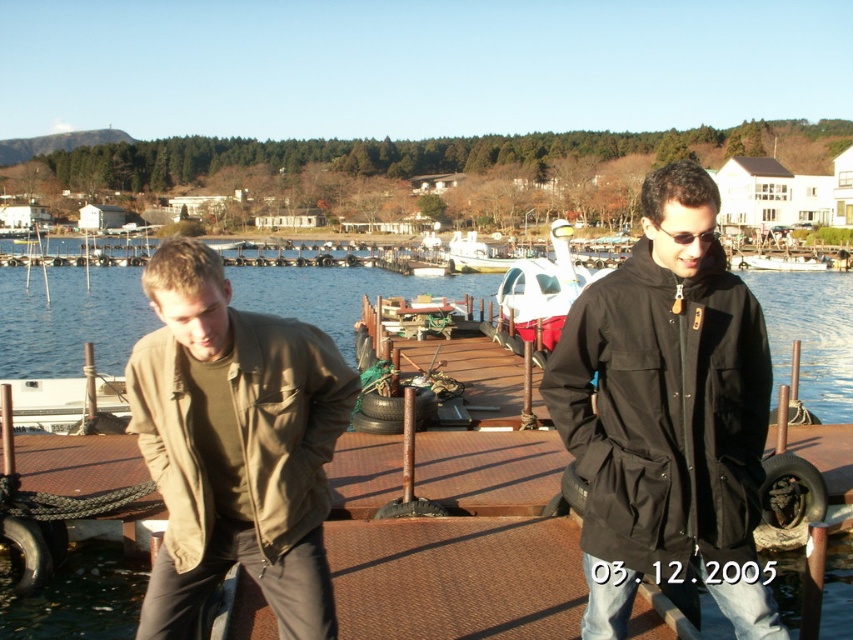
You are planning to take a photo of the black cotton jacket at center and the white glossy pod at center from a position where both are fully visible. Based on their heights, which object might require you to adjust your camera angle to ensure it is fully captured in the photo?

The black cotton jacket at center is not as tall as the white glossy pod at center, so you might need to adjust your camera angle to include the taller white glossy pod at center in the photo.